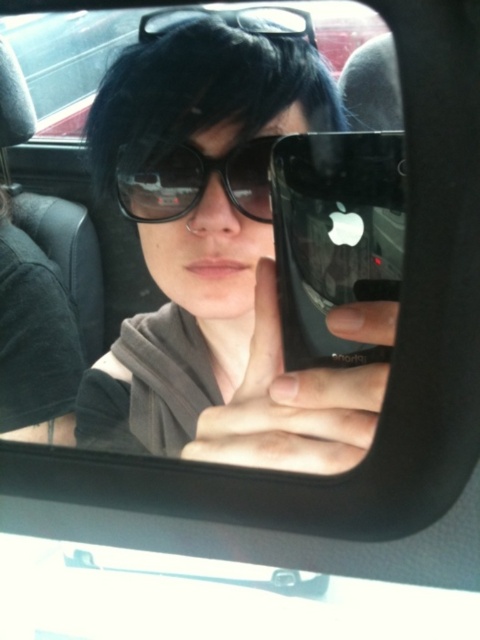
You are a photographer trying to capture the reflection of the phone screen in the rearview mirror. The phone is held by the person at point (335, 236). Where should you position your camera to ensure the reflection of the phone screen is visible in the mirror?

The point (335, 236) is on the black glossy phone at center, so positioning the camera directly in line with the phone and the mirror will allow the reflection of the phone screen to be visible in the rearview mirror.

You are a photographer trying to capture a clear image of the black glossy phone at center and the black plastic sunglasses at center in the rearview mirror. Which object should you focus on first to ensure both are in focus?

The black glossy phone at center is in front of the black plastic sunglasses at center, so focusing on the black glossy phone at center first will ensure both are in focus since it is closer to the camera.

You are a photographer trying to capture the reflection of the phone and sunglasses in the rearview mirror. Which object, the black glossy phone at center or the black plastic sunglasses at center, is closer to the mirror surface?

The black glossy phone at center is positioned under the black plastic sunglasses at center, so the black plastic sunglasses at center is closer to the mirror surface.